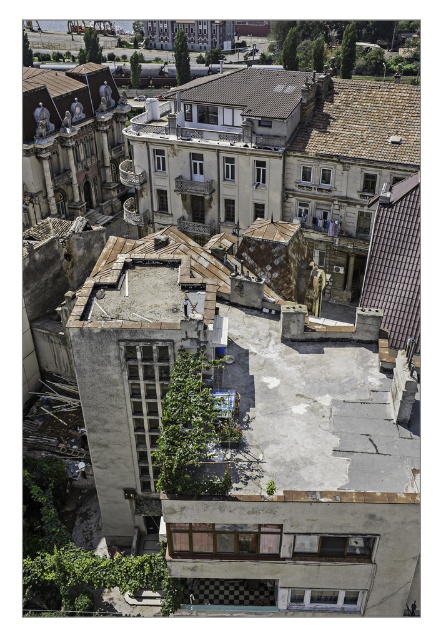
Does brown tiled roof at upper right appear over brown shingles at upper left?

Actually, brown tiled roof at upper right is below brown shingles at upper left.

Is brown tiled roof at upper right bigger than brown shingles at upper left?

Yes, brown tiled roof at upper right is bigger than brown shingles at upper left.

Is point (411, 253) closer to viewer compared to point (85, 84)?

Yes, it is in front of point (85, 84).

Locate an element on the screen. This screenshot has width=441, height=640. brown tiled roof at upper right is located at coordinates (396, 266).

Which is below, brown tile roof at upper right or brown shingles at upper left?

brown tile roof at upper right

Can you confirm if brown tile roof at upper right is positioned to the left of brown shingles at upper left?

Incorrect, brown tile roof at upper right is not on the left side of brown shingles at upper left.

Who is more distant from viewer, (340, 106) or (33, 68)?

Point (33, 68)

What are the coordinates of `brown tile roof at upper right` in the screenshot? It's located at (363, 124).

Is brown tile roof at upper right wider than brown tiled roof at upper center?

No, brown tile roof at upper right is not wider than brown tiled roof at upper center.

Between brown tile roof at upper right and brown tiled roof at upper center, which one is positioned higher?

Positioned higher is brown tiled roof at upper center.

Where is `brown tile roof at upper right`? brown tile roof at upper right is located at coordinates (363, 124).

You are a GUI agent. You are given a task and a screenshot of the screen. Output one action in this format:
    pyautogui.click(x=<x>, y=<y>)
    Task: Click on the brown tile roof at upper right
    Image resolution: width=441 pixels, height=640 pixels.
    Given the screenshot: What is the action you would take?
    pyautogui.click(x=363, y=124)